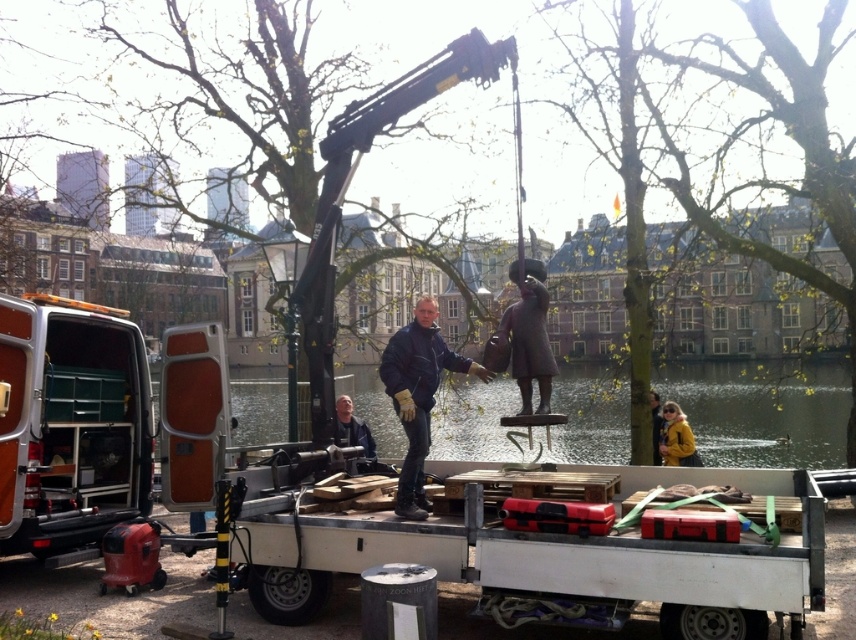
You are a delivery driver who needs to load a new package onto the white wooden trailer truck at center. However, there is a blue matte jacket at center in the way. Can you move the jacket to make space?

The white wooden trailer truck at center is bigger than the blue matte jacket at center, so you can move the jacket to the side or another area to create space for the new package.

You are standing in the park near the canal, and you want to take a photo of the bronze statue at center. Your camera has a maximum zoom range of 5 meters. Can you capture the statue clearly without moving closer?

The bronze statue at center is 6.51 meters away from the viewer. Since the camera can only zoom up to 5 meters, you cannot capture the statue clearly without moving closer.